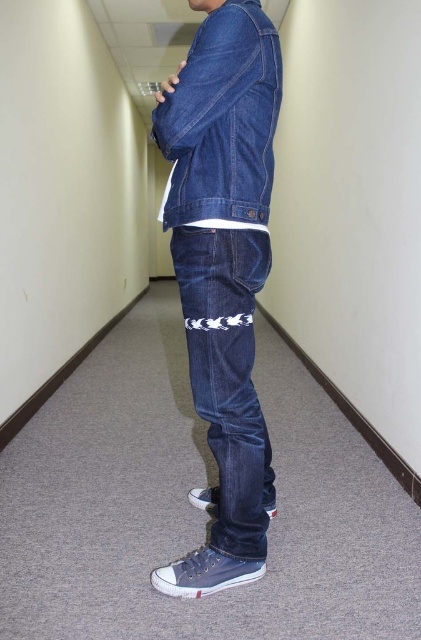
You are a fashion designer observing a model in a hallway. The model is wearing dark blue denim jeans at center and a denim jacket at center. Which piece of clothing is longer in height?

The dark blue denim jeans at center is taller than the denim jacket at center, so the jeans are longer in height.

You are designing a floor plan for a new hallway and need to ensure there is enough space for a person wearing the dark blue denim jeans at center. The jeans are positioned at coordinates approximately 0.586 on the x and 0.542 on the y. If the hallway is 10 meters long and 2 meters wide, will the jeans fit comfortably within the hallway dimensions?

The dark blue denim jeans at center is located at point (x=228, y=374), which falls within the hallway dimensions of 10 meters long and 2 meters wide. Therefore, the jeans will fit comfortably within the space.